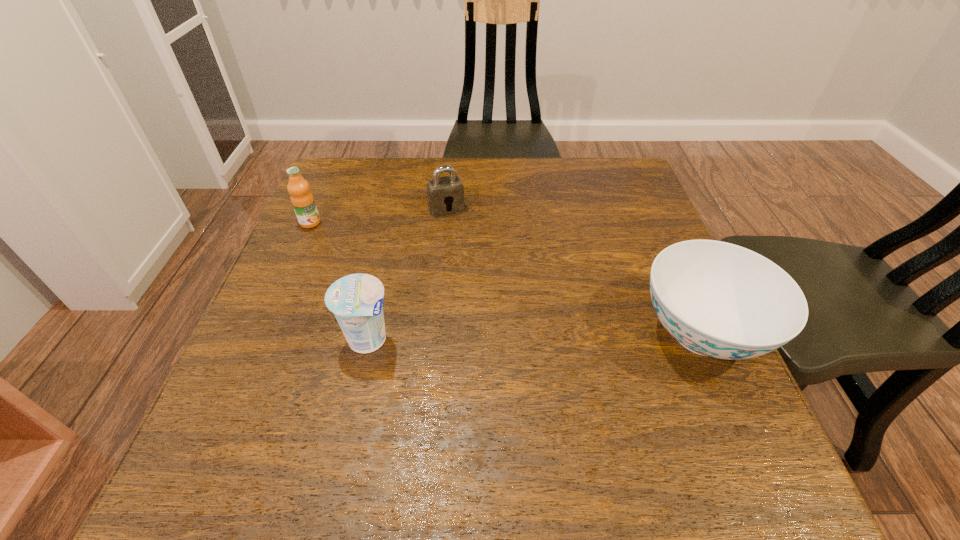
Identify the location of vacant spot on the desktop that is between the yogurt and the rightmost object and is positioned on the label of the leftmost object. This screenshot has height=540, width=960. (517, 336).

Find the location of a particular element. free space on the desktop that is between the third object from right to left and the chinaware and is positioned at the front of the padlock near the keyhole is located at coordinates (514, 336).